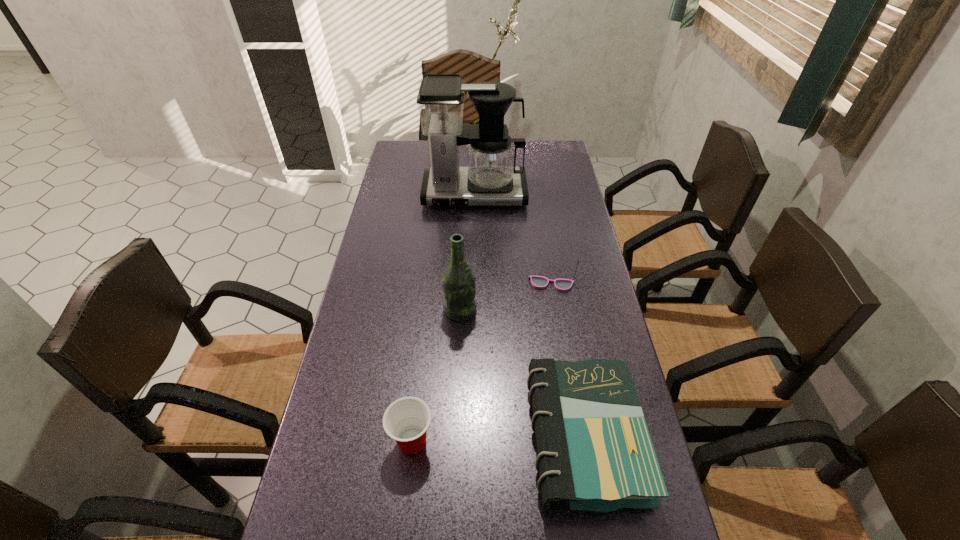
I want to click on free space between the paperback book and the cup, so click(x=498, y=440).

At what (x,y) coordinates should I click in order to perform the action: click on free space between the second farthest object and the tallest object. Please return your answer as a coordinate pair (x, y). This screenshot has width=960, height=540. Looking at the image, I should click on (513, 239).

Select which object appears as the second closest to the fourth nearest object. Please provide its 2D coordinates. Your answer should be formatted as a tuple, i.e. [(x, y)], where the tuple contains the x and y coordinates of a point satisfying the conditions above.

[(595, 453)]

Identify which object is located as the fourth nearest to the paperback book. Please provide its 2D coordinates. Your answer should be formatted as a tuple, i.e. [(x, y)], where the tuple contains the x and y coordinates of a point satisfying the conditions above.

[(490, 178)]

Identify the location of free space that satisfies the following two spatial constraints: 1. at the front of the tallest object where the controls are located; 2. on the surface of the beer bottle. The height and width of the screenshot is (540, 960). (472, 310).

You are a GUI agent. You are given a task and a screenshot of the screen. Output one action in this format:
    pyautogui.click(x=<x>, y=<y>)
    Task: Click on the blank space that satisfies the following two spatial constraints: 1. at the front of the fourth nearest object where the controls are located; 2. on the right side of the farthest object
    This screenshot has width=960, height=540.
    Given the screenshot: What is the action you would take?
    (472, 284)

This screenshot has width=960, height=540. What are the coordinates of `free region that satisfies the following two spatial constraints: 1. on the surface of the second tallest object; 2. on the front side of the cup` in the screenshot? It's located at [x=455, y=441].

Image resolution: width=960 pixels, height=540 pixels. Identify the location of free location that satisfies the following two spatial constraints: 1. on the surface of the second tallest object; 2. on the front side of the cup. (455, 441).

At what (x,y) coordinates should I click in order to perform the action: click on blank space that satisfies the following two spatial constraints: 1. on the front side of the spectacles; 2. on the surface of the fourth shortest object. Please return your answer as a coordinate pair (x, y). The height and width of the screenshot is (540, 960). Looking at the image, I should click on (555, 310).

Locate an element on the screen. This screenshot has width=960, height=540. vacant region that satisfies the following two spatial constraints: 1. on the surface of the second tallest object; 2. on the right side of the paperback book is located at coordinates (455, 439).